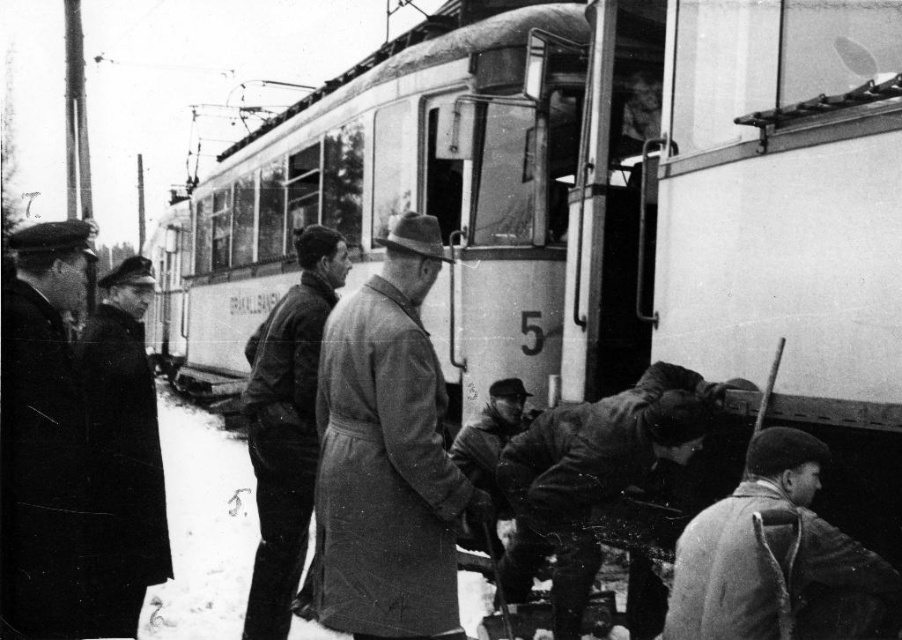
Question: Which point is farther to the camera?

Choices:
 (A) 818,609
 (B) 465,460

Answer: (B)

Question: Which object appears farthest from the camera in this image?

Choices:
 (A) dark gray coat at center
 (B) dark brown leather jacket at lower right
 (C) dark brown leather jacket at center

Answer: (C)

Question: In this image, where is dark brown leather jacket at lower center located relative to dark brown leather jacket at center?

Choices:
 (A) below
 (B) above

Answer: (B)

Question: Can you confirm if dark gray coat at left is smaller than dark brown leather jacket at center?

Choices:
 (A) yes
 (B) no

Answer: (A)

Question: Which point appears closest to the camera in this image?

Choices:
 (A) (463, 460)
 (B) (382, 472)

Answer: (B)

Question: Can you confirm if dark brown leather jacket at lower right is smaller than dark brown leather jacket at center?

Choices:
 (A) no
 (B) yes

Answer: (B)